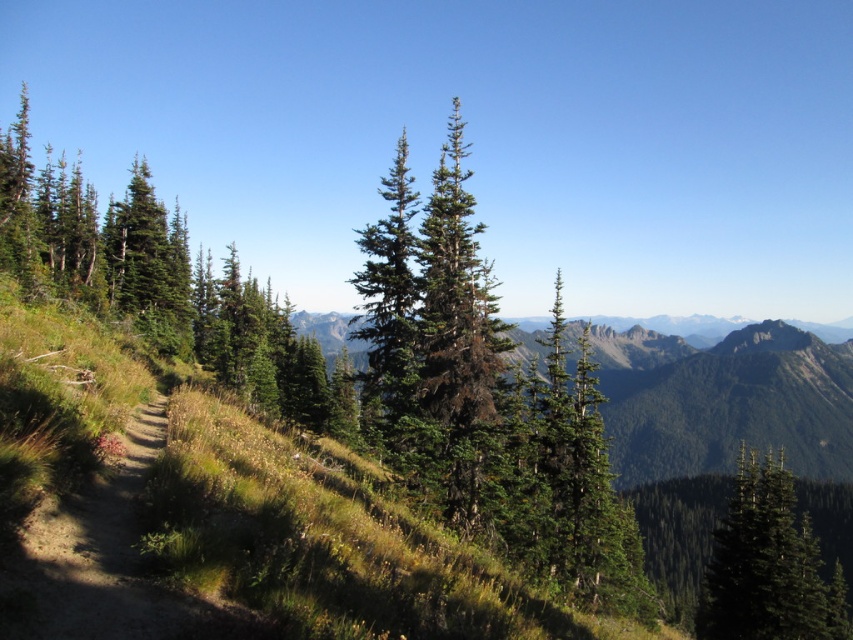
Question: Among these objects, which one is farthest from the camera?

Choices:
 (A) green textured tree at center
 (B) green matte evergreen tree at center

Answer: (B)

Question: Can you confirm if green matte tree at right is positioned above green matte evergreen tree at center?

Choices:
 (A) yes
 (B) no

Answer: (B)

Question: From the image, what is the correct spatial relationship of green needle-like tree at center-left in relation to green matte evergreen tree at center?

Choices:
 (A) right
 (B) left

Answer: (B)

Question: Which is nearer to the green needle-like tree at center-left?

Choices:
 (A) green matte evergreen tree at center
 (B) green textured tree at center
 (C) green matte tree at right

Answer: (A)

Question: Does green needle-like tree at center-left come behind green matte evergreen tree at center?

Choices:
 (A) yes
 (B) no

Answer: (A)

Question: Which object appears closest to the camera in this image?

Choices:
 (A) green matte evergreen tree at center
 (B) green matte tree at right
 (C) green textured tree at center

Answer: (C)